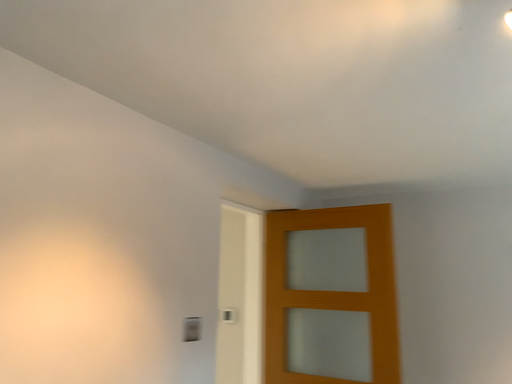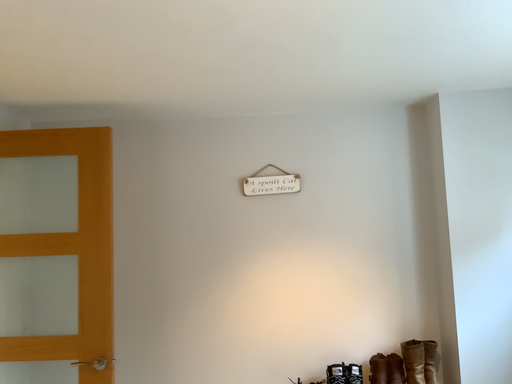
Question: Which way did the camera rotate in the video?

Choices:
 (A) rotated downward
 (B) rotated upward

Answer: (A)